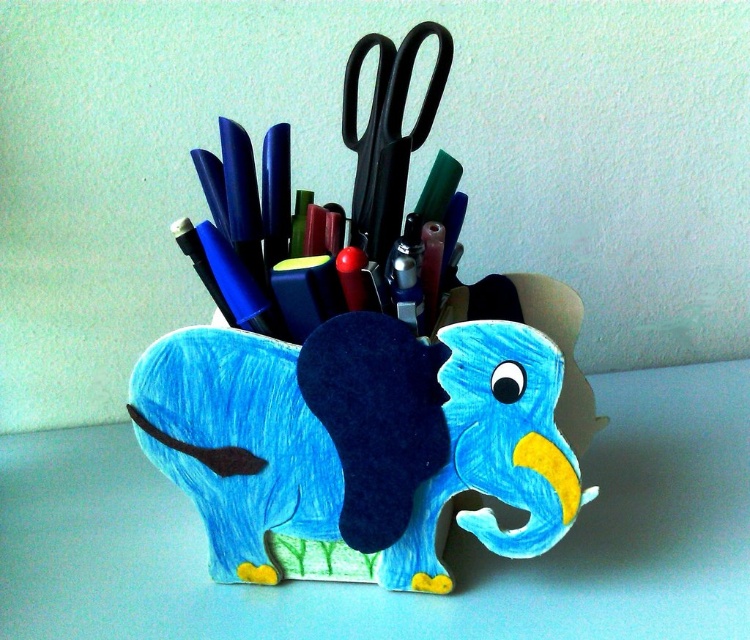
You need to place a new pen into the blue felt elephant at center. However, you also have the black plastic scissors at center nearby. Which object do you think has enough space to accommodate the pen?

The blue felt elephant at center is bigger than the black plastic scissors at center, so the blue felt elephant at center has enough space to accommodate the pen.

You are standing 1.5 meters away from the elephant pen holder. If you move forward 0.5 meters, will the point at coordinates point (358, 321) be closer than 1 meter to you?

The distance of point (358, 321) from camera is 1.00 meters. After moving forward 0.5 meters, your distance to the point becomes 0.5 meters, which is less than 1 meter. Yes, it will be closer than 1 meter.

You are organizing your desk and want to place the blue felt elephant at center and the black plastic scissors at center. Since the elephant is taller, will it block the scissors from view when placed side by side on the desk?

The blue felt elephant at center is taller than the black plastic scissors at center, so if placed side by side on the desk, the elephant may block the scissors from view depending on their placement.